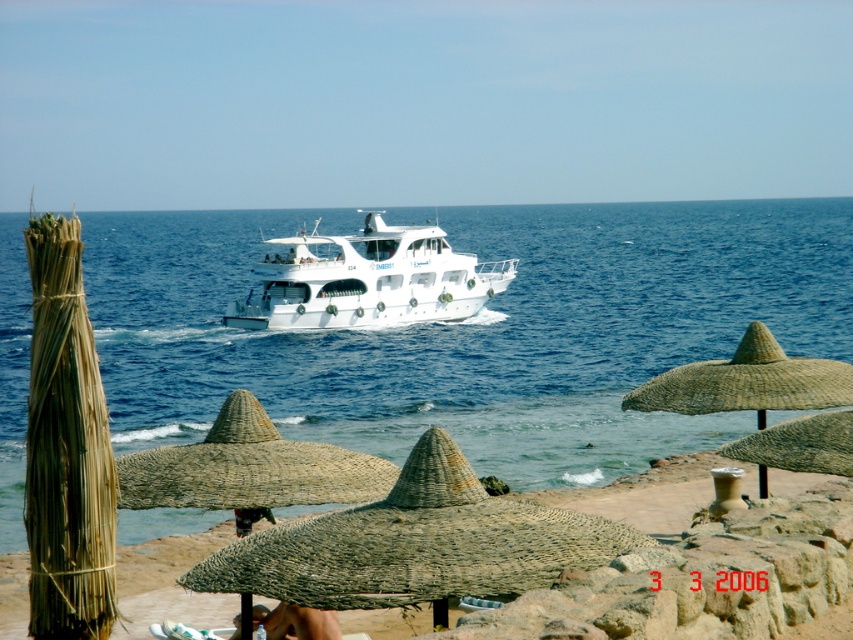
Question: From the image, what is the correct spatial relationship of brown woven umbrella at center in relation to white glossy boat at center?

Choices:
 (A) above
 (B) below

Answer: (B)

Question: Which object appears closest to the camera in this image?

Choices:
 (A) natural straw umbrella at lower center
 (B) blue water at center
 (C) white glossy boat at center
 (D) brown woven umbrella at center

Answer: (D)

Question: In this image, where is blue water at center located relative to brown woven umbrella at center?

Choices:
 (A) above
 (B) below

Answer: (A)

Question: Which point appears closest to the camera in this image?

Choices:
 (A) (350, 458)
 (B) (589, 550)

Answer: (B)

Question: Does blue water at center have a lesser width compared to brown woven umbrella at center?

Choices:
 (A) no
 (B) yes

Answer: (A)

Question: Estimate the real-world distances between objects in this image. Which object is closer to the natural straw umbrella at center?

Choices:
 (A) natural straw umbrella at lower center
 (B) brown woven umbrella at center
 (C) white glossy boat at center

Answer: (A)